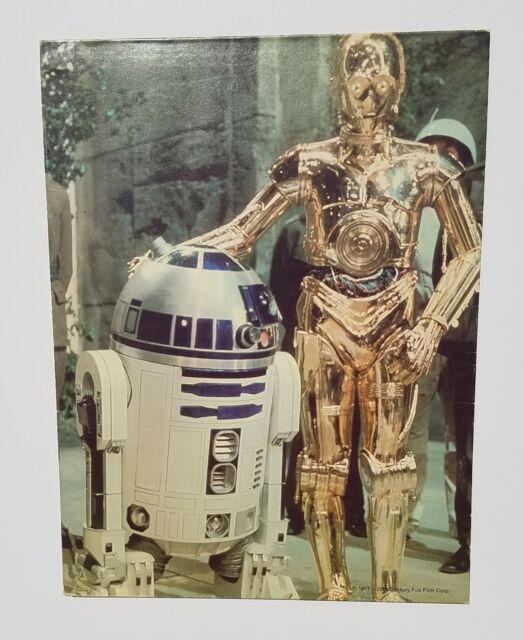
At what (x,y) coordinates should I click in order to perform the action: click on light. Please return your answer as a coordinate pair (x, y). Image resolution: width=524 pixels, height=640 pixels. Looking at the image, I should click on (135, 523).